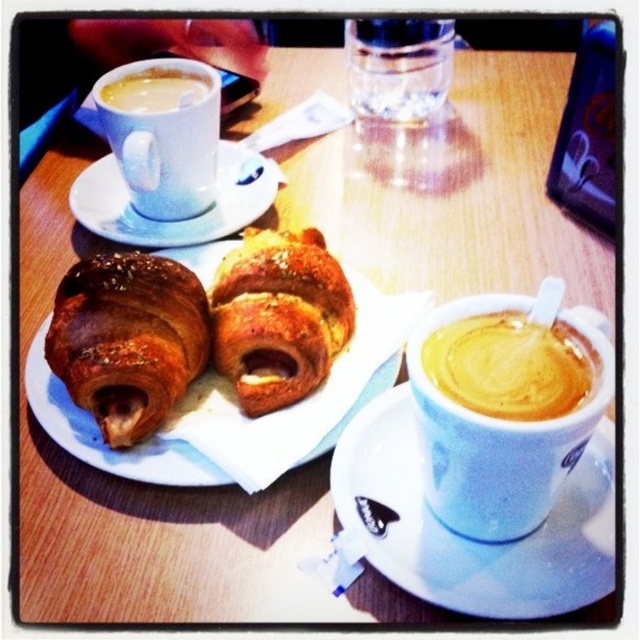
Question: Is white ceramic saucer at lower right bigger than transparent glass at upper center?

Choices:
 (A) no
 (B) yes

Answer: (B)

Question: Where is golden brown croissant at center located in relation to white ceramic saucer at upper left in the image?

Choices:
 (A) above
 (B) below

Answer: (B)

Question: Which point is farther to the camera?

Choices:
 (A) (173, 97)
 (B) (429, 44)
 (C) (529, 442)

Answer: (B)

Question: Which object is farther from the camera taking this photo?

Choices:
 (A) matte white cup at upper center
 (B) white ceramic saucer at upper left
 (C) golden frothy coffee at center
 (D) transparent glass at upper center

Answer: (D)

Question: Where is golden frothy coffee at center located in relation to white ceramic saucer at upper left in the image?

Choices:
 (A) right
 (B) left

Answer: (A)

Question: Which of these objects is positioned closest to the matte white cup at upper left?

Choices:
 (A) golden frothy coffee at center
 (B) white ceramic saucer at lower right
 (C) matte white cup at upper center

Answer: (B)